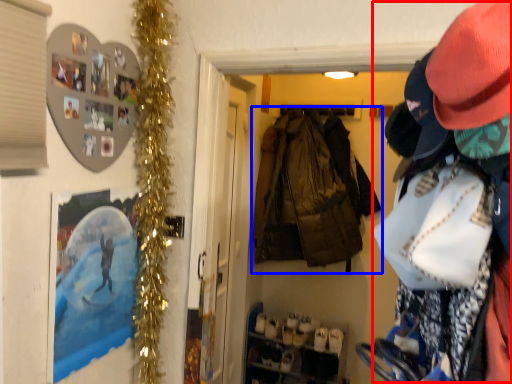
Question: Which point is further to the camera, person (highlighted by a red box) or jacket (highlighted by a blue box)?

Choices:
 (A) person
 (B) jacket

Answer: (B)